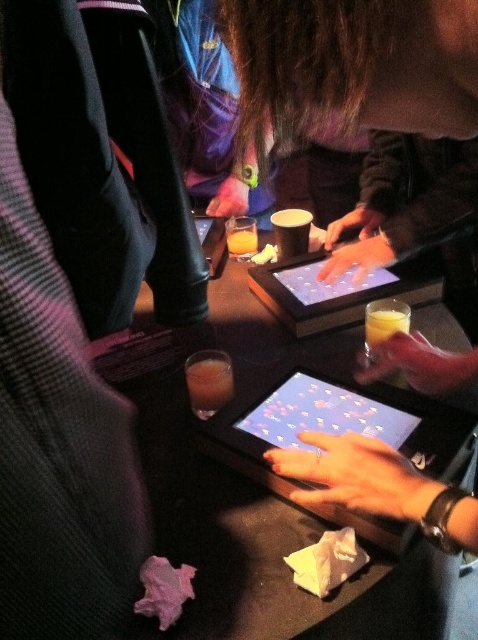
Does matte black tablet at center have a greater width compared to translucent plastic cup at center?

Indeed, matte black tablet at center has a greater width compared to translucent plastic cup at center.

Is matte black tablet at center closer to camera compared to translucent plastic cup at center?

Yes, matte black tablet at center is closer to the viewer.

Which is in front, point (377, 540) or point (207, 371)?

Positioned in front is point (377, 540).

Find the location of a particular element. Image resolution: width=478 pixels, height=640 pixels. matte black tablet at center is located at coordinates (335, 422).

Can you confirm if translucent plastic cup at center is wider than translucent glass at center?

Yes.

Is point (203, 355) positioned behind point (253, 253)?

That is False.

The image size is (478, 640). What do you see at coordinates (208, 381) in the screenshot? I see `translucent plastic cup at center` at bounding box center [208, 381].

This screenshot has height=640, width=478. What are the coordinates of `translucent plastic cup at center` in the screenshot? It's located at (208, 381).

Describe the element at coordinates (208, 436) in the screenshot. I see `shiny black tablet at center` at that location.

Is point (196, 422) closer to viewer compared to point (231, 380)?

That is True.

The width and height of the screenshot is (478, 640). Identify the location of shiny black tablet at center. (208, 436).